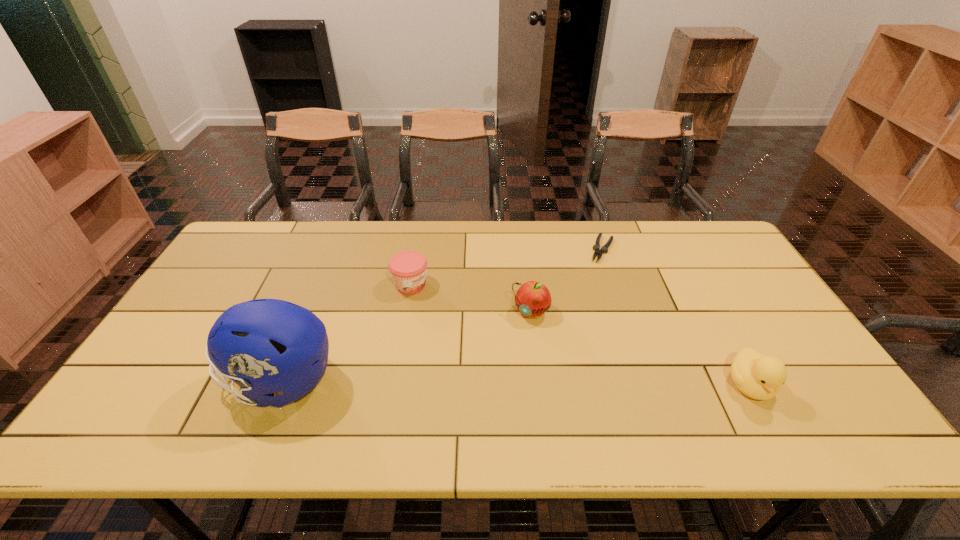
The height and width of the screenshot is (540, 960). I want to click on free spot on the desktop that is between the tallest object and the rightmost object and is positioned at the gripping part of the pliers, so click(544, 383).

Find the location of `free spot on the desktop that is between the leftmost object and the rightmost object and is positioned on the surface of the apple`. free spot on the desktop that is between the leftmost object and the rightmost object and is positioned on the surface of the apple is located at coordinates (476, 383).

I want to click on vacant space on the desktop that is between the leftmost object and the rightmost object and is positioned on the front label of the second object from left to right, so click(x=571, y=384).